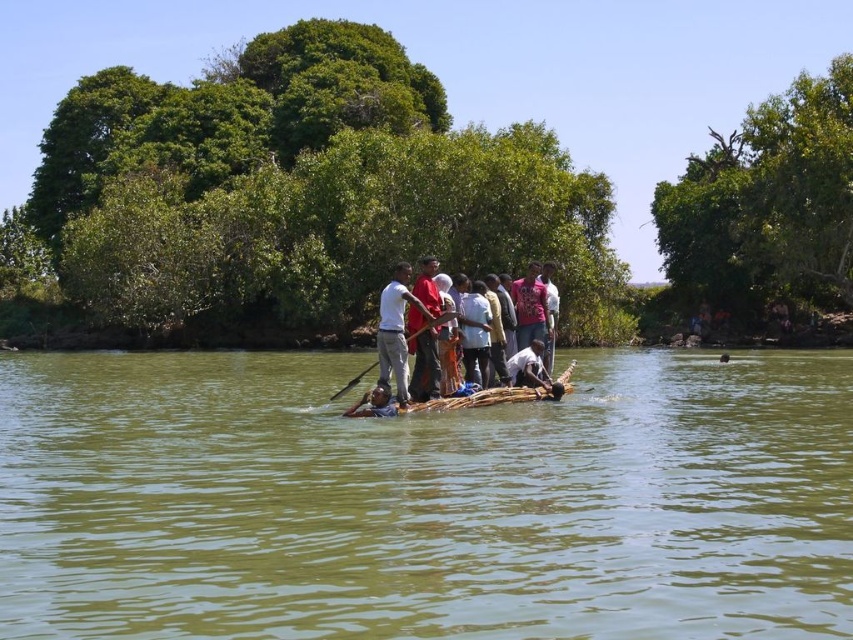
The height and width of the screenshot is (640, 853). What do you see at coordinates (401, 326) in the screenshot?
I see `white matte shirt at center` at bounding box center [401, 326].

Which is below, white matte shirt at center or dark brown wooden raft at center?

dark brown wooden raft at center is lower down.

Is point (381, 342) closer to viewer compared to point (386, 392)?

No, it is behind (386, 392).

Where is `white matte shirt at center`? white matte shirt at center is located at coordinates (401, 326).

Is white cotton shirt at center thinner than dark brown wooden raft at center?

No, white cotton shirt at center is not thinner than dark brown wooden raft at center.

From the picture: Can you confirm if white cotton shirt at center is positioned to the right of dark brown wooden raft at center?

Yes, white cotton shirt at center is to the right of dark brown wooden raft at center.

Between point (386, 292) and point (364, 397), which one is positioned in front?

Point (364, 397) is in front.

Find the location of a particular element. white cotton shirt at center is located at coordinates (412, 332).

Does red fabric shirt at center have a smaller size compared to brown wooden raft at center?

Yes, red fabric shirt at center is smaller than brown wooden raft at center.

Does red fabric shirt at center have a greater height compared to brown wooden raft at center?

Yes.

Describe the element at coordinates (424, 365) in the screenshot. I see `red fabric shirt at center` at that location.

Find the location of a particular element. red fabric shirt at center is located at coordinates (424, 365).